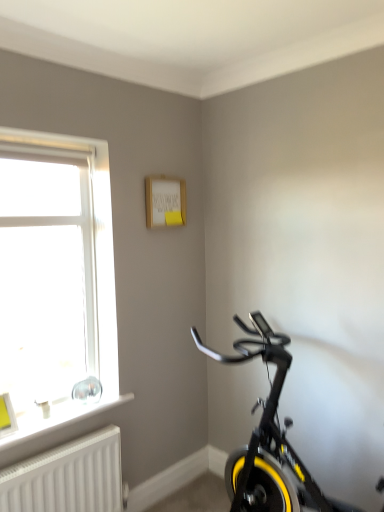
Question: Looking at the image, does white plastic window at left seem bigger or smaller compared to white plastic window sill at lower left?

Choices:
 (A) small
 (B) big

Answer: (B)

Question: In terms of height, does white plastic window at left look taller or shorter compared to white plastic window sill at lower left?

Choices:
 (A) short
 (B) tall

Answer: (B)

Question: Which object is the farthest from the yellow rubber bicycle wheel at lower right?

Choices:
 (A) white textured radiator at lower left
 (B) black matte exercise bike at lower right
 (C) white plastic window at left
 (D) white plastic window sill at lower left

Answer: (C)

Question: Which is nearer to the white plastic window sill at lower left?

Choices:
 (A) yellow rubber bicycle wheel at lower right
 (B) white plastic window at left
 (C) black matte exercise bike at lower right
 (D) white textured radiator at lower left

Answer: (D)